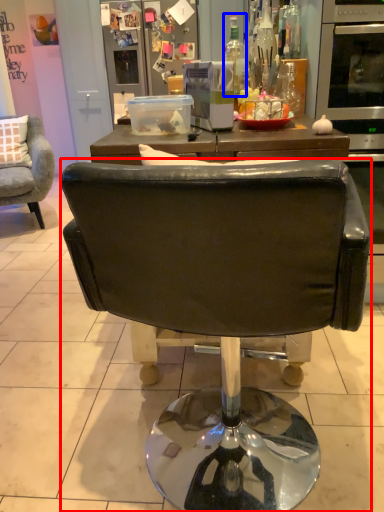
Question: Which point is further to the camera, chair (highlighted by a red box) or bottle (highlighted by a blue box)?

Choices:
 (A) chair
 (B) bottle

Answer: (B)